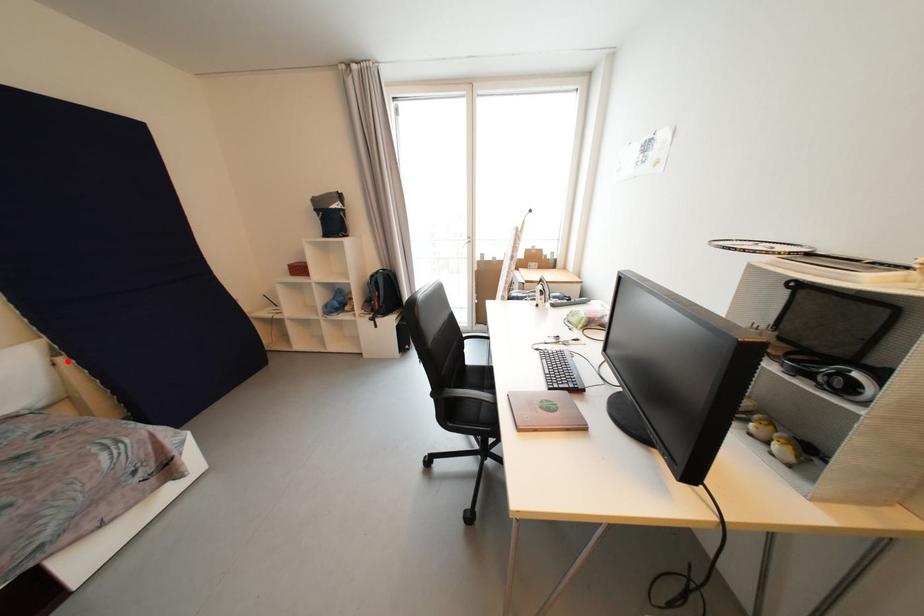
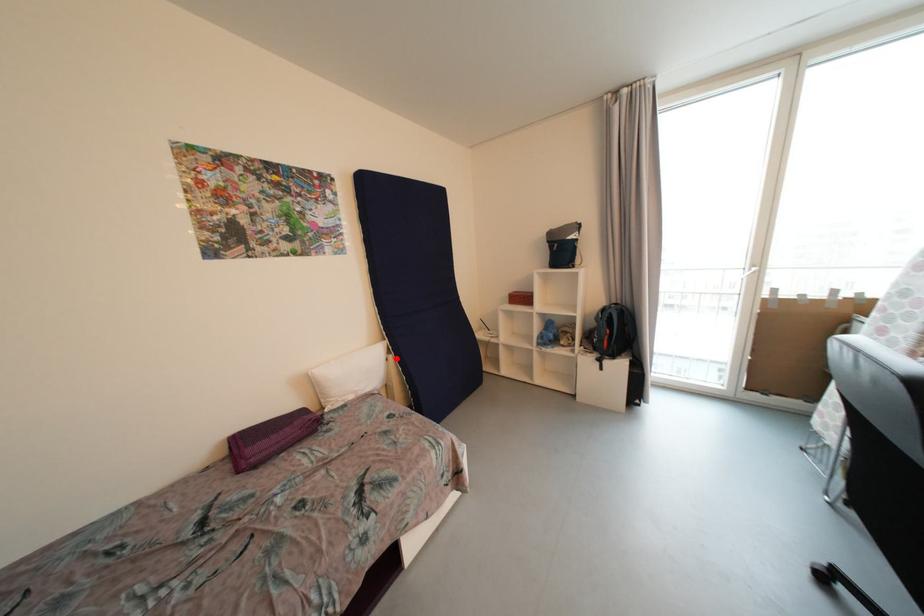
I am providing you with two images of the same scene from different viewpoints. A red point is marked on the first image and another point is marked on the second image. Is the red point in image1 aligned with the point shown in image2?

Yes